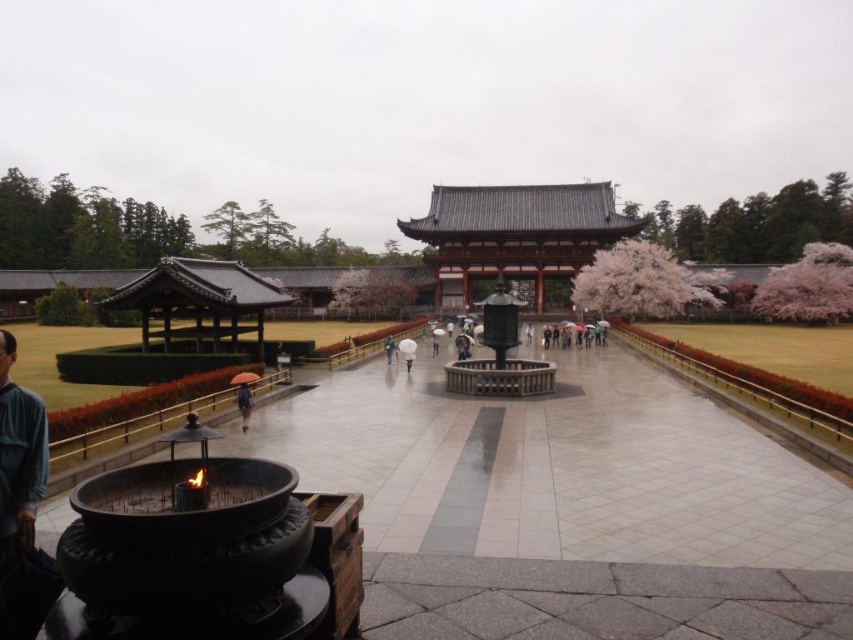
Is blue fabric umbrella at lower left below orange fabric umbrella at center?

Correct, blue fabric umbrella at lower left is located below orange fabric umbrella at center.

Does blue fabric umbrella at lower left appear over orange fabric umbrella at center?

No.

Is point (26, 442) positioned behind point (238, 406)?

No, it is in front of (238, 406).

I want to click on blue fabric umbrella at lower left, so click(19, 497).

Which is below, matte gray wooden palace at center or orange fabric umbrella at center?

orange fabric umbrella at center is below.

Is matte gray wooden palace at center to the right of orange fabric umbrella at center from the viewer's perspective?

Yes, matte gray wooden palace at center is to the right of orange fabric umbrella at center.

Does point (590, 243) come behind point (242, 384)?

That is True.

This screenshot has width=853, height=640. I want to click on matte gray wooden palace at center, so click(x=515, y=237).

Based on the photo, can you confirm if matte gray wooden palace at center is wider than blue fabric umbrella at lower left?

Yes.

Does matte gray wooden palace at center have a greater height compared to blue fabric umbrella at lower left?

Yes.

What do you see at coordinates (515, 237) in the screenshot? Image resolution: width=853 pixels, height=640 pixels. I see `matte gray wooden palace at center` at bounding box center [515, 237].

Where is `matte gray wooden palace at center`? The width and height of the screenshot is (853, 640). matte gray wooden palace at center is located at coordinates (515, 237).